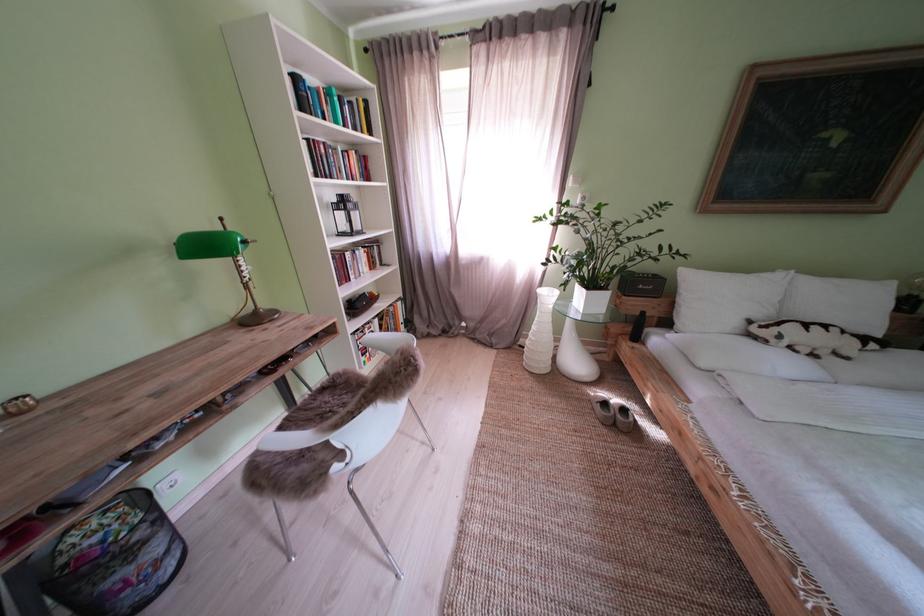
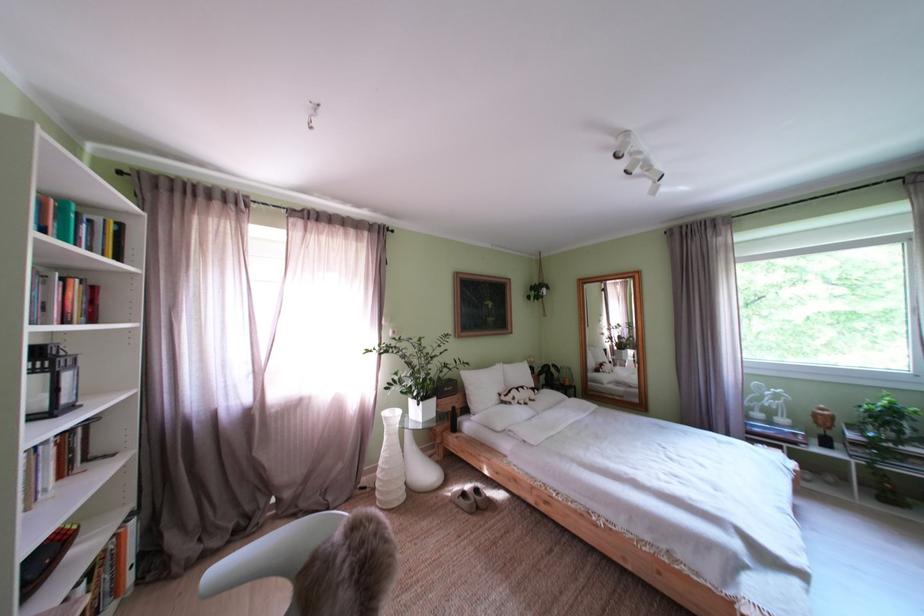
In the second image, find the point that corresponds to point 544,331 in the first image.

(395, 460)